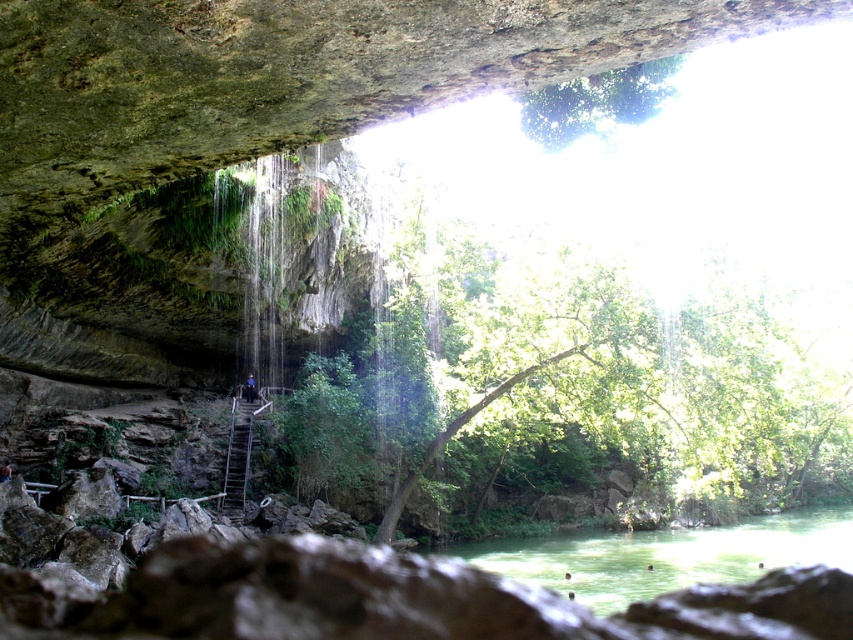
Between point (563, 595) and point (227, 497), which one is positioned in front?

Point (563, 595) is in front.

Can you confirm if green translucent water at lower center is positioned to the right of metallic staircase at center?

Indeed, green translucent water at lower center is positioned on the right side of metallic staircase at center.

Who is more forward, [546,557] or [234,481]?

Point [234,481] is in front.

Identify the location of green translucent water at lower center. (666, 556).